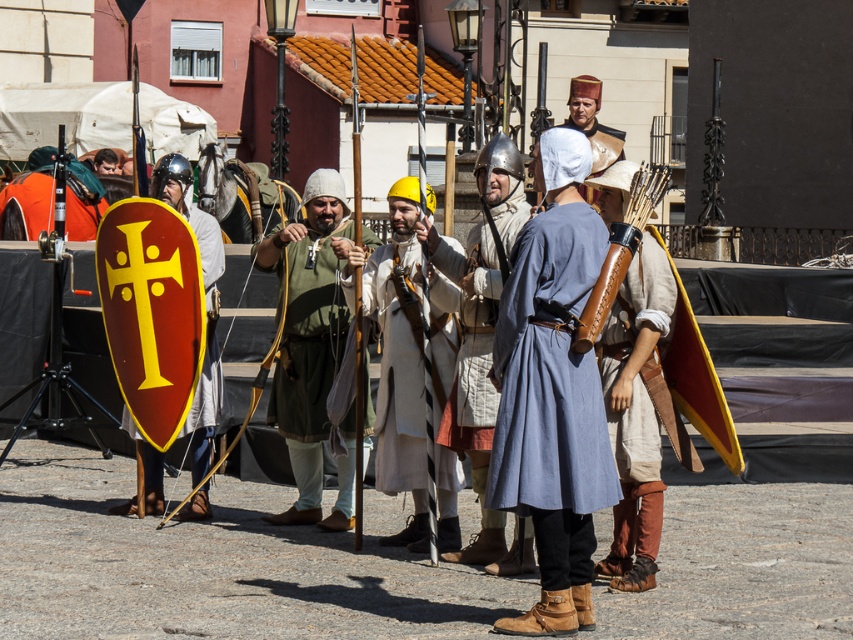
Which is above, green fabric at center or white woolen coat at center?

Positioned higher is white woolen coat at center.

Is green fabric at center behind white woolen coat at center?

Yes.

Where is `green fabric at center`? green fabric at center is located at coordinates (311, 346).

Locate an element on the screen. This screenshot has height=640, width=853. green fabric at center is located at coordinates (311, 346).

Does point (563, 220) come farther from viewer compared to point (476, 163)?

No, it is in front of (476, 163).

Is blue linen tunic at center thinner than matte silver helmet at center?

Incorrect, blue linen tunic at center's width is not less than matte silver helmet at center's.

Is point (556, 205) farther from viewer compared to point (531, 570)?

No, it is not.

Where is `blue linen tunic at center`? The height and width of the screenshot is (640, 853). blue linen tunic at center is located at coordinates (549, 371).

Is green fabric at center thinner than matte silver helmet at center?

No.

Consider the image. Is green fabric at center below matte silver helmet at center?

Correct, green fabric at center is located below matte silver helmet at center.

Find the location of a particular element. The height and width of the screenshot is (640, 853). green fabric at center is located at coordinates (311, 346).